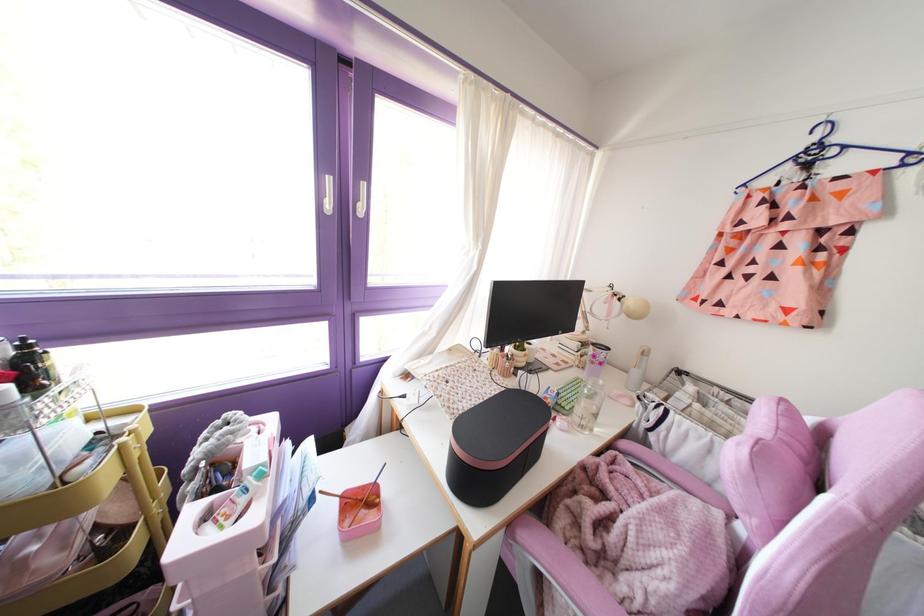
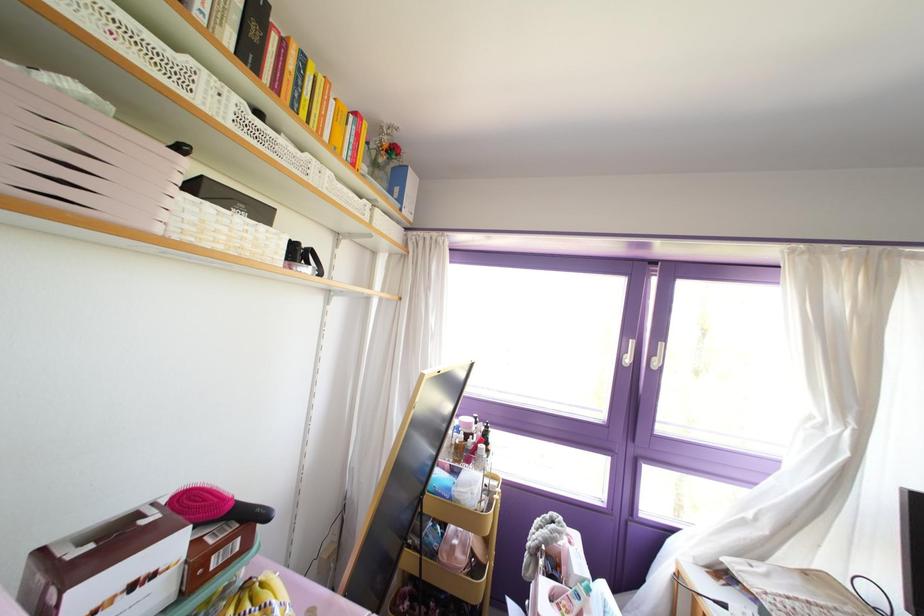
Locate, in the second image, the point that corresponds to [329,205] in the first image.

(626, 360)